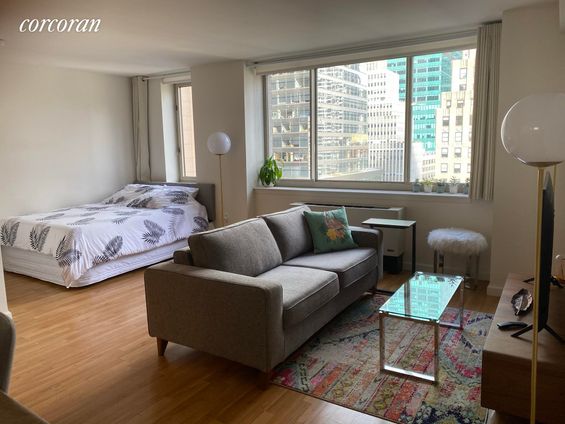
This screenshot has height=424, width=565. Find the location of `stool`. stool is located at coordinates (458, 237).